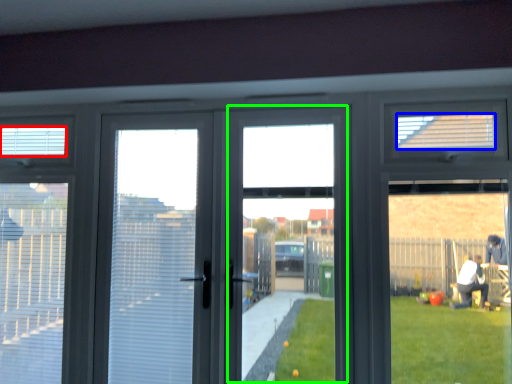
Question: Based on their relative distances, which object is farther from blind (highlighted by a red box)? Choose from blind (highlighted by a blue box) and window screen (highlighted by a green box).

Choices:
 (A) blind
 (B) window screen

Answer: (A)